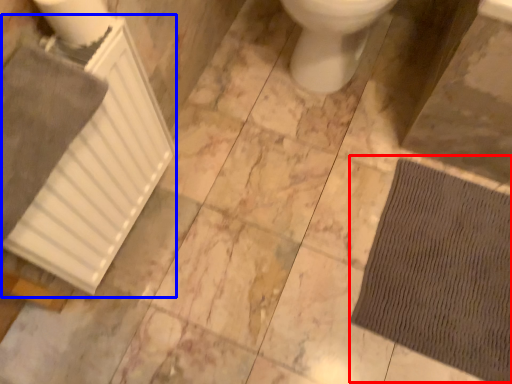
Question: Which object appears farthest to the camera in this image, doormat (highlighted by a red box) or radiator (highlighted by a blue box)?

Choices:
 (A) doormat
 (B) radiator

Answer: (A)